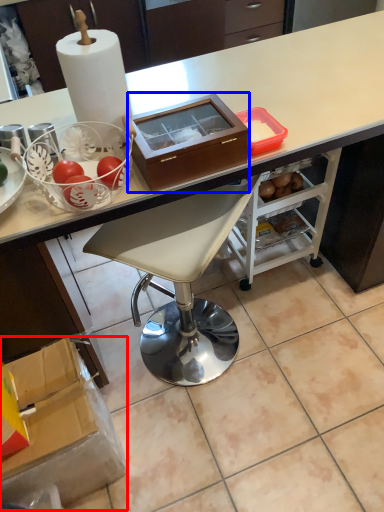
Question: Among these objects, which one is farthest to the camera, box (highlighted by a red box) or box (highlighted by a blue box)?

Choices:
 (A) box
 (B) box

Answer: (A)